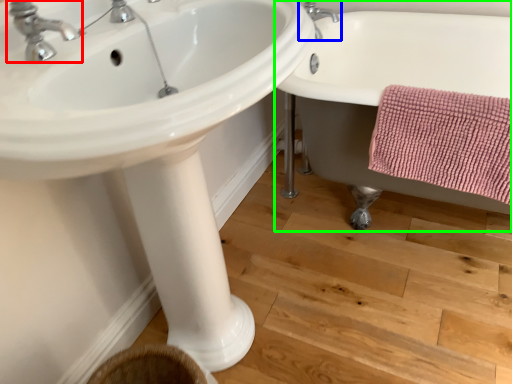
Question: Which is nearer to the tap (highlighted by a red box)? tap (highlighted by a blue box) or bathtub (highlighted by a green box).

Choices:
 (A) tap
 (B) bathtub

Answer: (B)